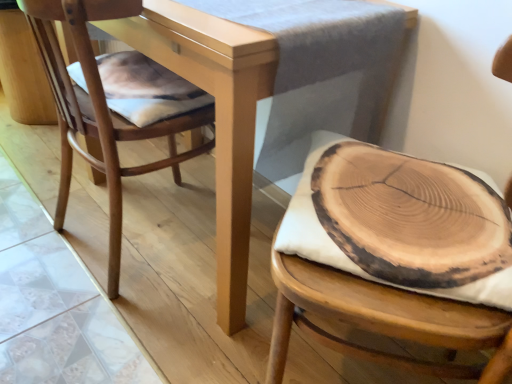
Question: Is wooden cushion at right, the first chair viewed from the right, at the back of matte wood table at center?

Choices:
 (A) no
 (B) yes

Answer: (A)

Question: Does matte wood table at center have a greater width compared to wooden cushion at right, the first chair viewed from the right?

Choices:
 (A) no
 (B) yes

Answer: (B)

Question: From a real-world perspective, is matte wood table at center physically above wooden cushion at right, which appears as the second chair when viewed from the left?

Choices:
 (A) yes
 (B) no

Answer: (B)

Question: From a real-world perspective, is matte wood table at center beneath wooden cushion at right, the first chair viewed from the right?

Choices:
 (A) yes
 (B) no

Answer: (A)

Question: Can you confirm if matte wood table at center is shorter than wooden cushion at right, the first chair viewed from the right?

Choices:
 (A) no
 (B) yes

Answer: (B)

Question: From a real-world perspective, is natural wood slice at center positioned above or below wooden cushion at right, which appears as the second chair when viewed from the left?

Choices:
 (A) below
 (B) above

Answer: (B)

Question: Is natural wood slice at center taller or shorter than wooden cushion at right, the first chair viewed from the right?

Choices:
 (A) short
 (B) tall

Answer: (A)

Question: From the image's perspective, is natural wood slice at center above or below wooden cushion at right, which appears as the second chair when viewed from the left?

Choices:
 (A) below
 (B) above

Answer: (B)

Question: Considering the positions of point pos(414,168) and point pos(500,71), is point pos(414,168) closer or farther from the camera than point pos(500,71)?

Choices:
 (A) farther
 (B) closer

Answer: (A)

Question: Considering the positions of natural wood chair at left, which is the first chair in left-to-right order, and matte wood table at center in the image, is natural wood chair at left, which is the first chair in left-to-right order, bigger or smaller than matte wood table at center?

Choices:
 (A) small
 (B) big

Answer: (A)

Question: Would you say natural wood chair at left, acting as the second chair starting from the right, is to the left or to the right of matte wood table at center in the picture?

Choices:
 (A) right
 (B) left

Answer: (B)

Question: Is natural wood chair at left, acting as the second chair starting from the right, wider or thinner than matte wood table at center?

Choices:
 (A) thin
 (B) wide

Answer: (A)

Question: From the image's perspective, is natural wood chair at left, which is the first chair in left-to-right order, above or below matte wood table at center?

Choices:
 (A) above
 (B) below

Answer: (B)

Question: Which is correct: wooden cushion at right, which appears as the second chair when viewed from the left, is inside matte wood table at center, or outside of it?

Choices:
 (A) inside
 (B) outside

Answer: (B)

Question: From a real-world perspective, is wooden cushion at right, the first chair viewed from the right, positioned above or below matte wood table at center?

Choices:
 (A) below
 (B) above

Answer: (B)